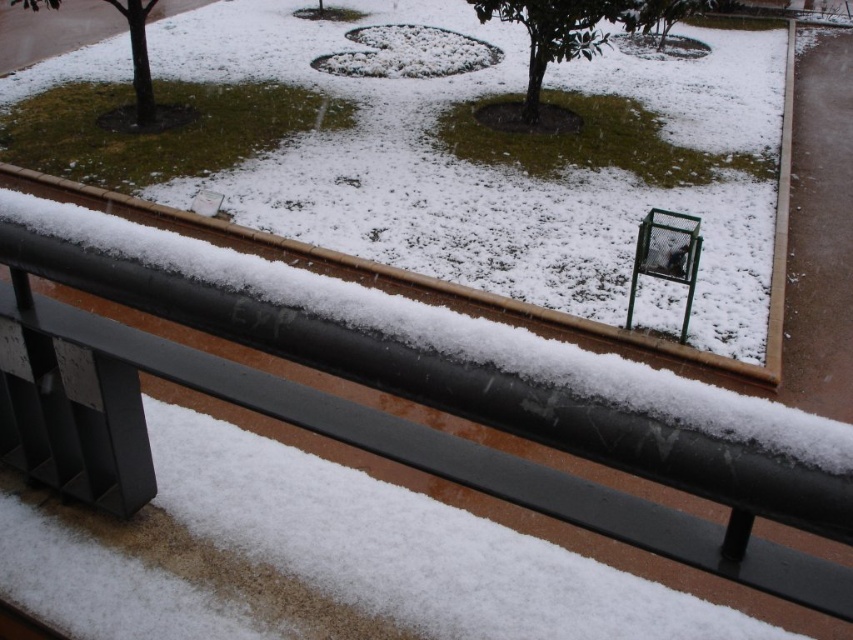
Does green matte tree at center appear on the left side of green matte tree at upper left?

In fact, green matte tree at center is to the right of green matte tree at upper left.

Does green matte tree at center appear over green matte tree at upper left?

Actually, green matte tree at center is below green matte tree at upper left.

Between point (593, 12) and point (138, 112), which one is positioned in front?

Point (593, 12) is more forward.

This screenshot has width=853, height=640. Find the location of `green matte tree at center`. green matte tree at center is located at coordinates (577, 29).